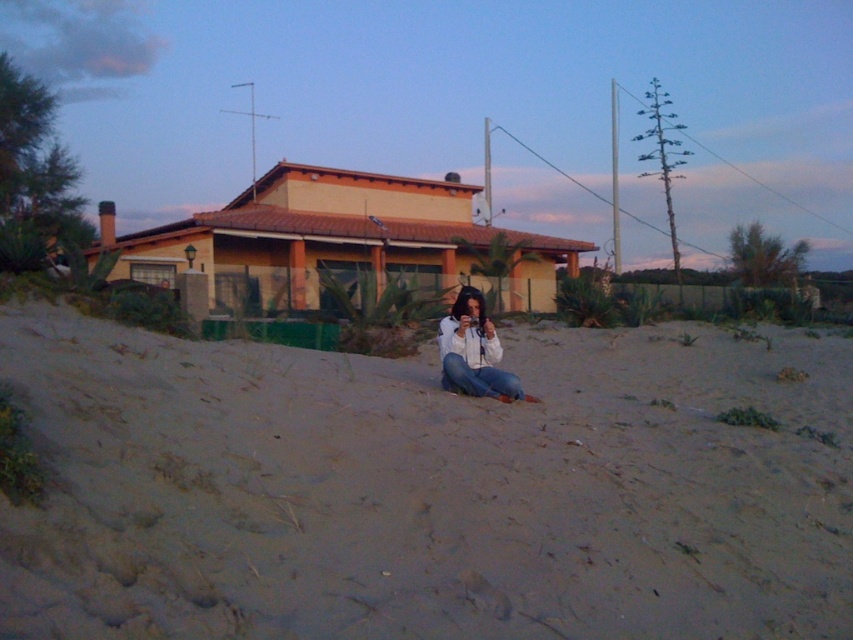
Between smooth sand at center and white matte shirt at center, which one is positioned lower?

smooth sand at center is lower down.

Is smooth sand at center wider than white matte shirt at center?

Yes, smooth sand at center is wider than white matte shirt at center.

Who is more forward, (x=480, y=456) or (x=480, y=376)?

Point (x=480, y=456) is more forward.

At what (x,y) coordinates should I click in order to perform the action: click on smooth sand at center. Please return your answer as a coordinate pair (x, y). This screenshot has width=853, height=640. Looking at the image, I should click on (426, 490).